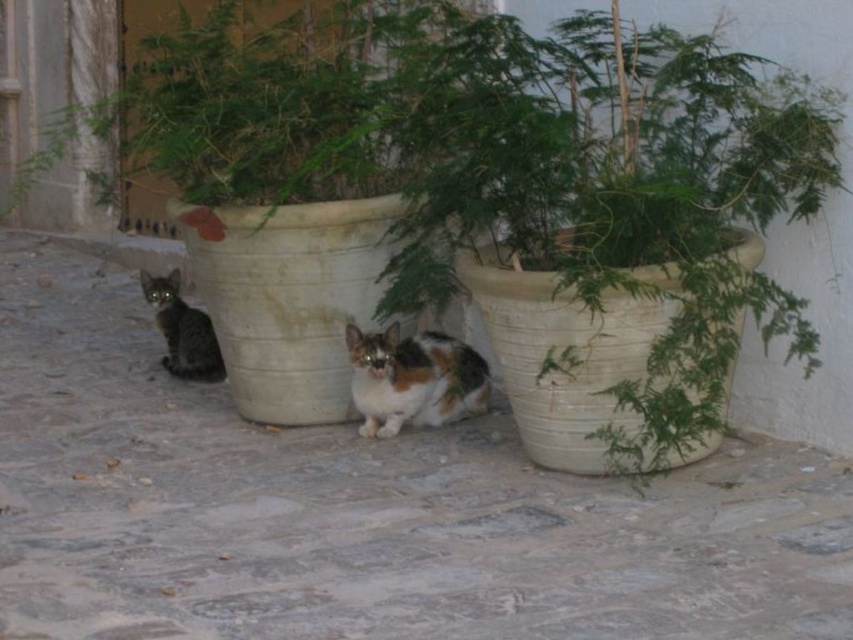
Question: Does calico fur cat at center appear on the right side of striped fur cat at lower left?

Choices:
 (A) yes
 (B) no

Answer: (A)

Question: Does calico fur cat at center appear over striped fur cat at lower left?

Choices:
 (A) no
 (B) yes

Answer: (A)

Question: Which point is farther from the camera taking this photo?

Choices:
 (A) (426, 346)
 (B) (210, 372)

Answer: (B)

Question: Where is calico fur cat at center located in relation to striped fur cat at lower left in the image?

Choices:
 (A) below
 (B) above

Answer: (A)